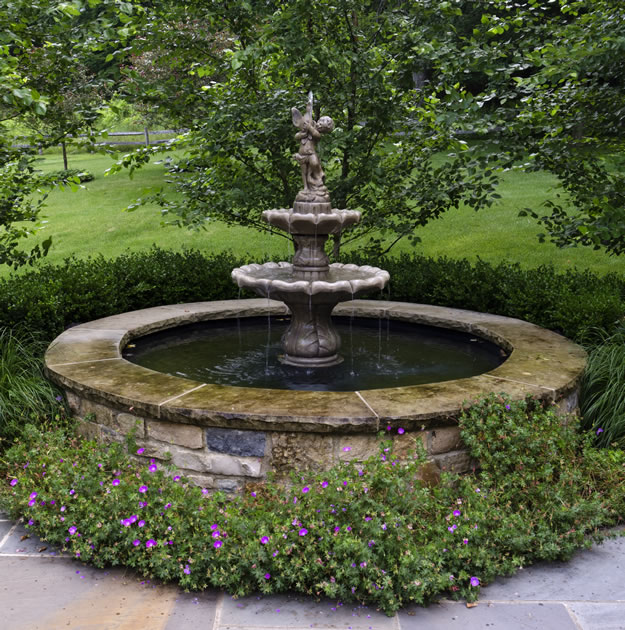
Identify the location of grey floor. (601, 586).